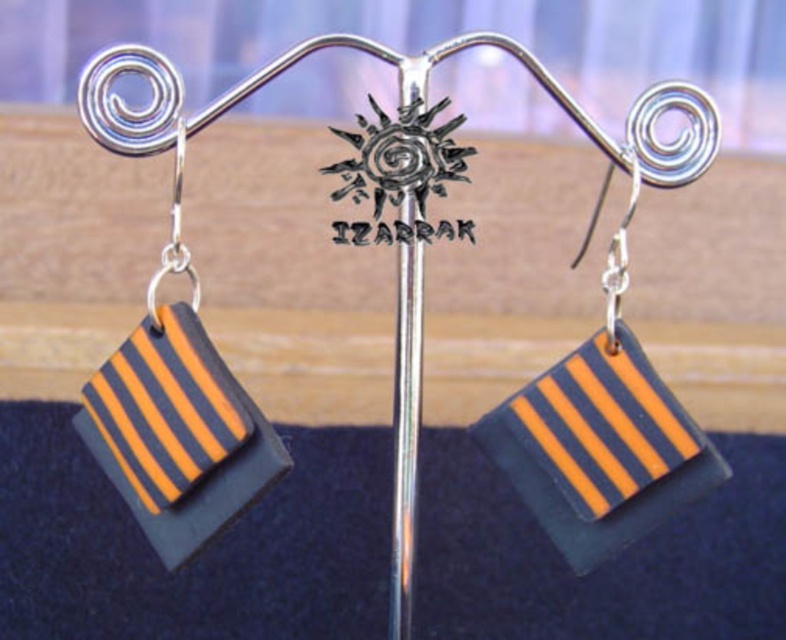
You are holding a small box that is 0.5 meters wide. You want to place it on the surface where the point at point (566, 540) is located. Can you fit the box there?

The distance between point (566, 540) and the viewer is 1.01 meters. Since the box is 0.5 meters wide, it can fit at that location as the space is sufficient.